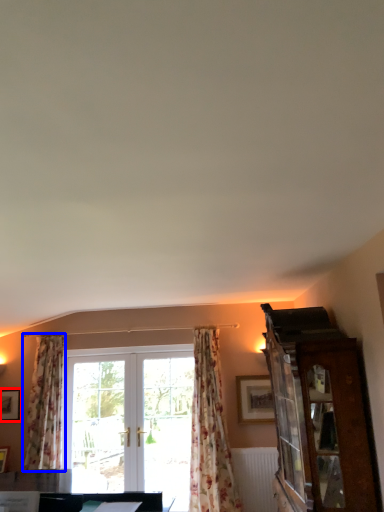
Question: Which object appears closest to the camera in this image, picture frame (highlighted by a red box) or curtain (highlighted by a blue box)?

Choices:
 (A) picture frame
 (B) curtain

Answer: (B)